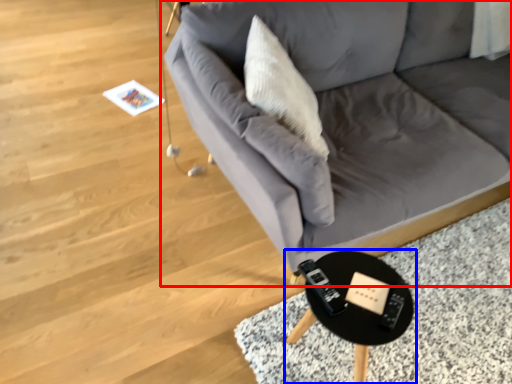
Question: Which object is further to the camera taking this photo, studio couch (highlighted by a red box) or table (highlighted by a blue box)?

Choices:
 (A) studio couch
 (B) table

Answer: (B)